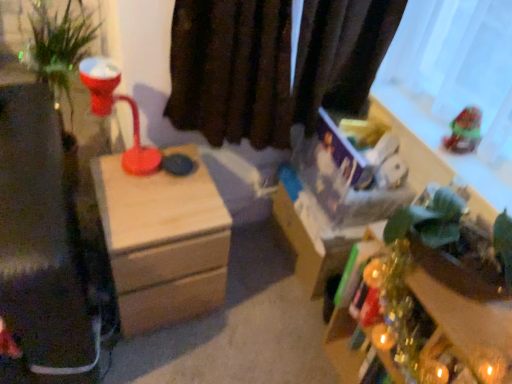
Question: Can you confirm if wooden nightstand at center is smaller than green matte plant at lower right?

Choices:
 (A) no
 (B) yes

Answer: (A)

Question: Considering the relative sizes of wooden nightstand at center and green matte plant at lower right in the image provided, is wooden nightstand at center wider than green matte plant at lower right?

Choices:
 (A) no
 (B) yes

Answer: (B)

Question: Does wooden nightstand at center appear on the left side of green matte plant at lower right?

Choices:
 (A) yes
 (B) no

Answer: (A)

Question: From the image's perspective, does wooden nightstand at center appear lower than green matte plant at lower right?

Choices:
 (A) no
 (B) yes

Answer: (A)

Question: Is wooden nightstand at center in contact with green matte plant at lower right?

Choices:
 (A) yes
 (B) no

Answer: (B)

Question: Considering the positions of green matte plant at lower right and wooden nightstand at center in the image, is green matte plant at lower right wider or thinner than wooden nightstand at center?

Choices:
 (A) thin
 (B) wide

Answer: (A)

Question: From the image's perspective, is green matte plant at lower right above or below wooden nightstand at center?

Choices:
 (A) above
 (B) below

Answer: (B)

Question: Does point (438, 259) appear closer or farther from the camera than point (166, 274)?

Choices:
 (A) farther
 (B) closer

Answer: (B)

Question: From a real-world perspective, relative to wooden nightstand at center, is green matte plant at lower right vertically above or below?

Choices:
 (A) below
 (B) above

Answer: (B)

Question: From a real-world perspective, relative to green matte plant at lower right, is shiny plastic toy at upper right vertically above or below?

Choices:
 (A) above
 (B) below

Answer: (A)

Question: From their relative heights in the image, would you say shiny plastic toy at upper right is taller or shorter than green matte plant at lower right?

Choices:
 (A) short
 (B) tall

Answer: (A)

Question: From the image's perspective, is shiny plastic toy at upper right located above or below green matte plant at lower right?

Choices:
 (A) below
 (B) above

Answer: (B)

Question: Considering the positions of shiny plastic toy at upper right and green matte plant at lower right in the image, is shiny plastic toy at upper right wider or thinner than green matte plant at lower right?

Choices:
 (A) thin
 (B) wide

Answer: (A)

Question: In terms of size, does shiny plastic toy at upper right appear bigger or smaller than wooden nightstand at center?

Choices:
 (A) big
 (B) small

Answer: (B)

Question: From the image's perspective, is shiny plastic toy at upper right positioned above or below wooden nightstand at center?

Choices:
 (A) above
 (B) below

Answer: (A)